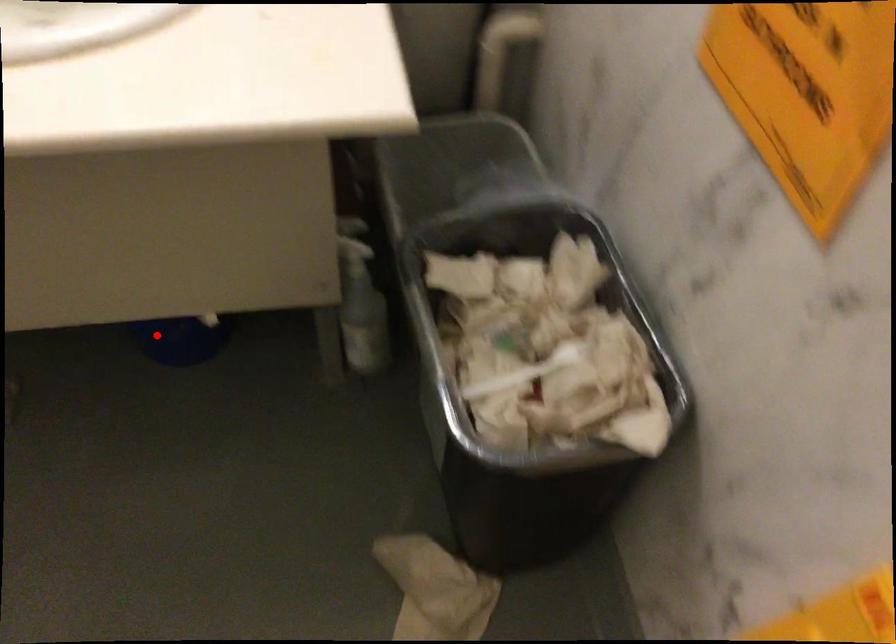
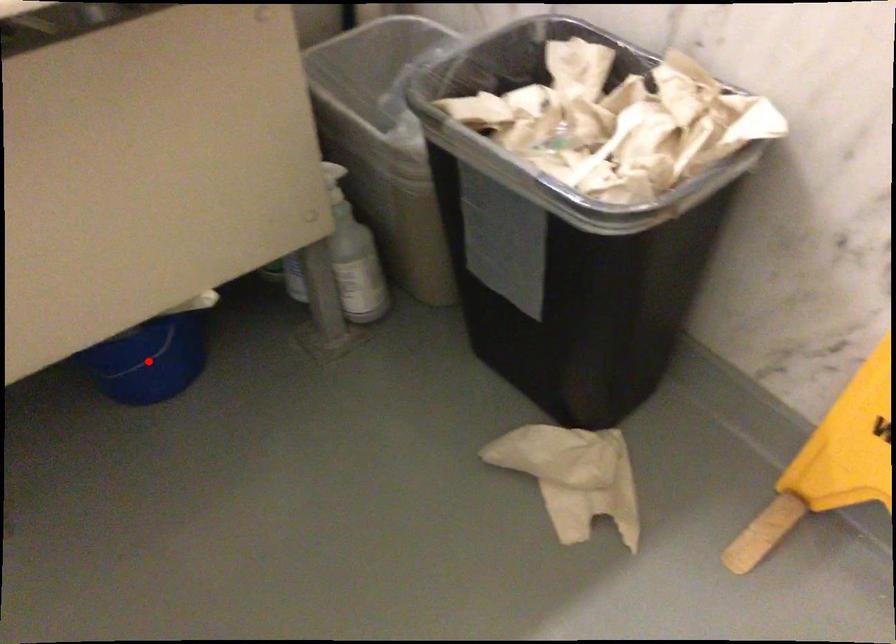
I am providing you with two images of the same scene from different viewpoints. A red point is marked on the first image and another point is marked on the second image. Does the point marked in image1 correspond to the same location as the one in image2?

Yes